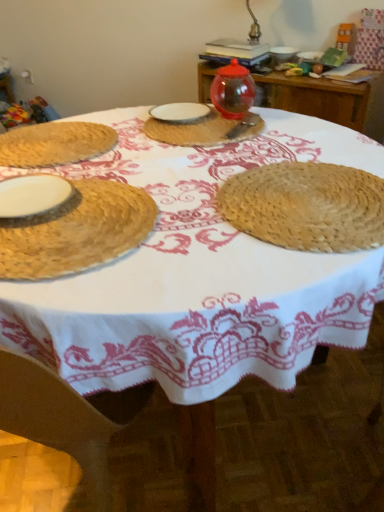
Where is `free space in front of matte wicker placemat at center`? free space in front of matte wicker placemat at center is located at coordinates (199, 163).